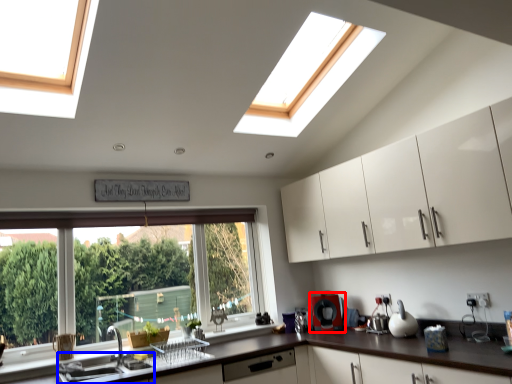
Question: Among these objects, which one is farthest to the camera, appliance (highlighted by a red box) or sink (highlighted by a blue box)?

Choices:
 (A) appliance
 (B) sink

Answer: (A)